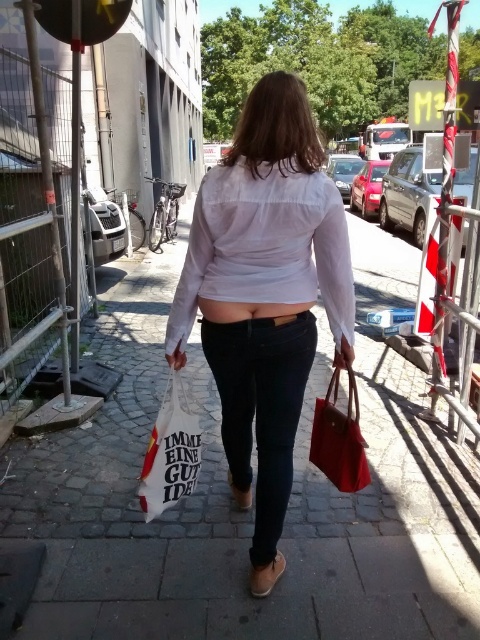
Does point (383, 568) lie in front of point (333, 308)?

No, (383, 568) is further to viewer.

The image size is (480, 640). In order to click on cobblestone pavement at center in this screenshot , I will do `click(241, 513)`.

You are a GUI agent. You are given a task and a screenshot of the screen. Output one action in this format:
    pyautogui.click(x=<x>, y=<y>)
    Task: Click on the matte white blouse at center
    The height and width of the screenshot is (640, 480).
    Given the screenshot: What is the action you would take?
    pyautogui.click(x=264, y=289)

Who is more forward, (254, 147) or (193, 452)?

Positioned in front is point (254, 147).

Find the location of a particular element. The width and height of the screenshot is (480, 640). matte white blouse at center is located at coordinates (264, 289).

Who is more distant from viewer, [112,576] or [248,442]?

The point [248,442] is behind.

Is point (29, 481) farther from camera compared to point (275, 515)?

Yes, point (29, 481) is farther from viewer.

Between point (369, 612) and point (313, 340), which one is positioned in front?

Point (369, 612)

The height and width of the screenshot is (640, 480). I want to click on cobblestone pavement at center, so click(241, 513).